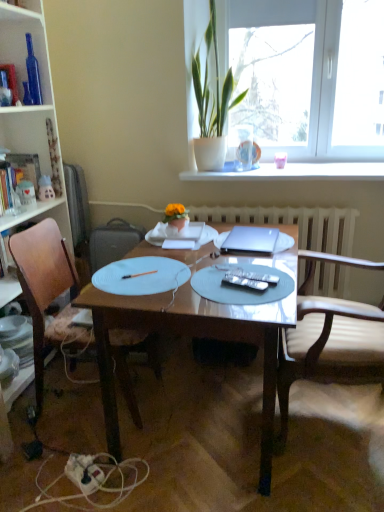
Find the location of `vacant space in between silver metallic remote control at center and white matte paper plate at center, arranged as the second paper plate when viewed from the right`. vacant space in between silver metallic remote control at center and white matte paper plate at center, arranged as the second paper plate when viewed from the right is located at coordinates (207, 284).